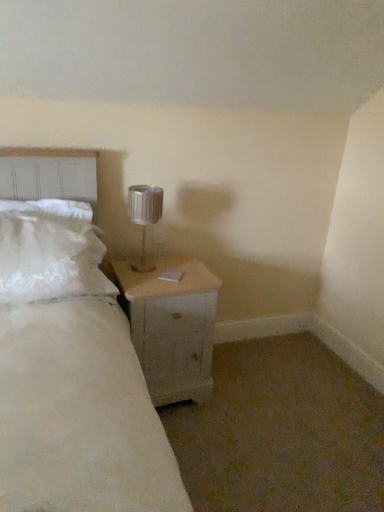
Question: Does white wood nightstand at lower right turn towards white fluffy pillow at left?

Choices:
 (A) yes
 (B) no

Answer: (B)

Question: Is the position of white wood nightstand at lower right more distant than that of white fluffy pillow at left?

Choices:
 (A) yes
 (B) no

Answer: (A)

Question: Can you confirm if white wood nightstand at lower right is smaller than white fluffy pillow at left?

Choices:
 (A) yes
 (B) no

Answer: (B)

Question: From the image's perspective, is white wood nightstand at lower right beneath white fluffy pillow at left?

Choices:
 (A) yes
 (B) no

Answer: (A)

Question: Considering the relative sizes of white wood nightstand at lower right and white fluffy pillow at left in the image provided, is white wood nightstand at lower right wider than white fluffy pillow at left?

Choices:
 (A) no
 (B) yes

Answer: (B)

Question: From the image's perspective, is white wood nightstand at lower right on top of white fluffy pillow at left?

Choices:
 (A) no
 (B) yes

Answer: (A)

Question: From the image's perspective, does white fluffy pillow at left appear higher than metallic silver lamp at upper right?

Choices:
 (A) yes
 (B) no

Answer: (B)

Question: Can you confirm if white fluffy pillow at left is smaller than metallic silver lamp at upper right?

Choices:
 (A) yes
 (B) no

Answer: (B)

Question: Does white fluffy pillow at left have a lesser height compared to metallic silver lamp at upper right?

Choices:
 (A) yes
 (B) no

Answer: (B)

Question: Is white fluffy pillow at left directly adjacent to metallic silver lamp at upper right?

Choices:
 (A) yes
 (B) no

Answer: (B)

Question: Does white fluffy pillow at left turn towards metallic silver lamp at upper right?

Choices:
 (A) no
 (B) yes

Answer: (A)

Question: Is white fluffy pillow at left bigger than metallic silver lamp at upper right?

Choices:
 (A) no
 (B) yes

Answer: (B)

Question: Does metallic silver lamp at upper right appear on the left side of white fluffy pillow at left?

Choices:
 (A) no
 (B) yes

Answer: (A)